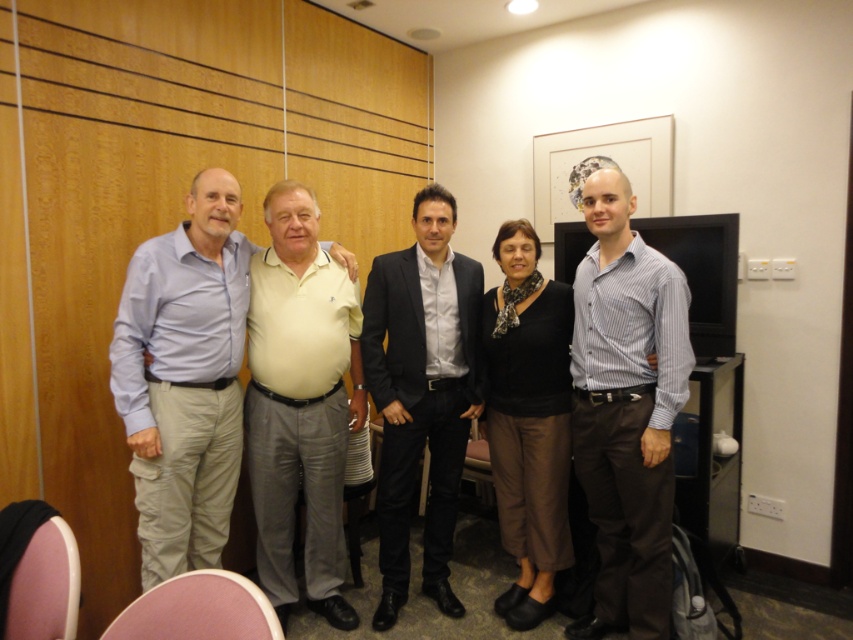
Can you confirm if striped cotton shirt at right is positioned below dark gray suit at center?

Indeed, striped cotton shirt at right is positioned under dark gray suit at center.

Can you confirm if striped cotton shirt at right is positioned to the left of dark gray suit at center?

No, striped cotton shirt at right is not to the left of dark gray suit at center.

Which is in front, point (619, 570) or point (392, 269)?

Point (619, 570)

Where is `striped cotton shirt at right`? The height and width of the screenshot is (640, 853). striped cotton shirt at right is located at coordinates (625, 404).

Does light blue shirt at left have a lesser width compared to dark gray suit at center?

Yes, light blue shirt at left is thinner than dark gray suit at center.

Does light blue shirt at left appear over dark gray suit at center?

Indeed, light blue shirt at left is positioned over dark gray suit at center.

Where is `light blue shirt at left`? This screenshot has width=853, height=640. light blue shirt at left is located at coordinates (184, 378).

Where is `light blue shirt at left`? The height and width of the screenshot is (640, 853). light blue shirt at left is located at coordinates (184, 378).

Does point (582, 486) come behind point (271, 493)?

Yes, point (582, 486) is behind point (271, 493).

How far apart are striped cotton shirt at right and light yellow polo shirt at center?

striped cotton shirt at right and light yellow polo shirt at center are 39.00 inches apart.

Which is in front, point (624, 588) or point (339, 561)?

Point (624, 588) is more forward.

Find the location of a particular element. striped cotton shirt at right is located at coordinates (625, 404).